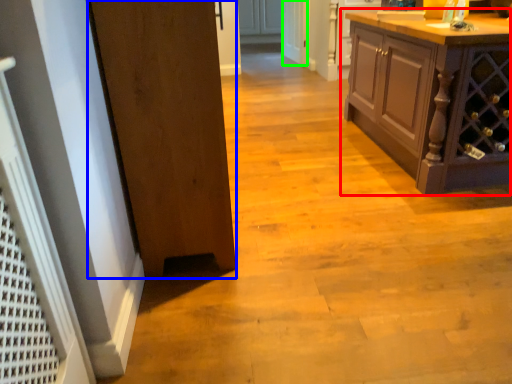
Question: Which object is the closest to the cabinetry (highlighted by a red box)? Choose among these: door (highlighted by a blue box) or screen door (highlighted by a green box).

Choices:
 (A) door
 (B) screen door

Answer: (A)